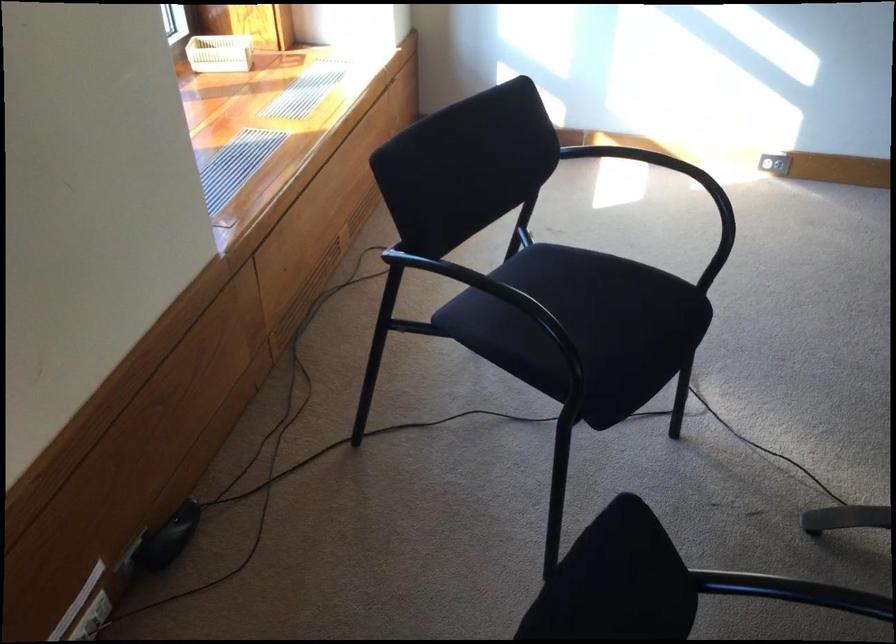
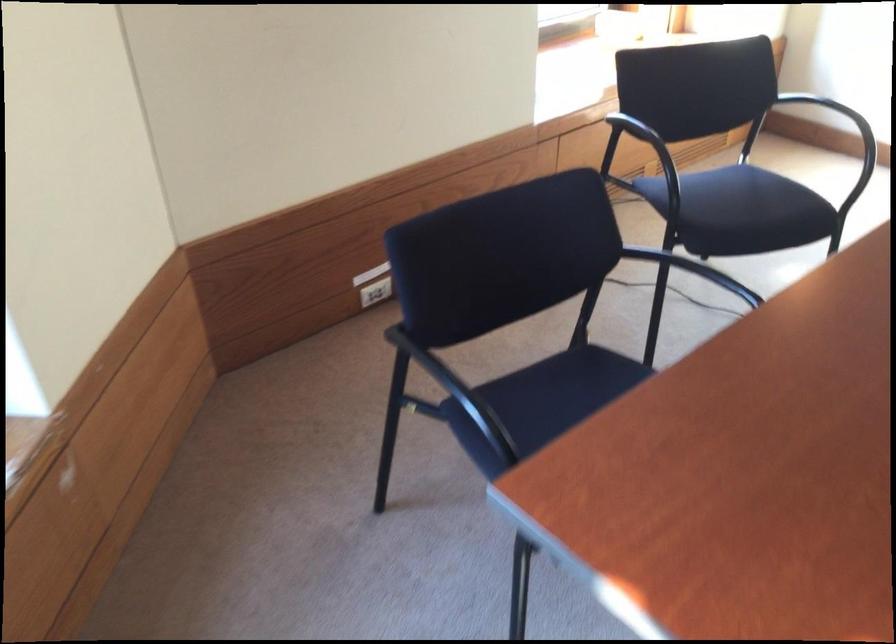
Where in the second image is the point corresponding to (x=609, y=352) from the first image?

(741, 211)